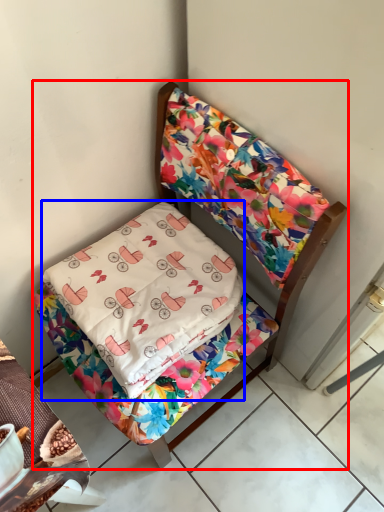
Question: Which object is closer to the camera taking this photo, furniture (highlighted by a red box) or pillow (highlighted by a blue box)?

Choices:
 (A) furniture
 (B) pillow

Answer: (A)